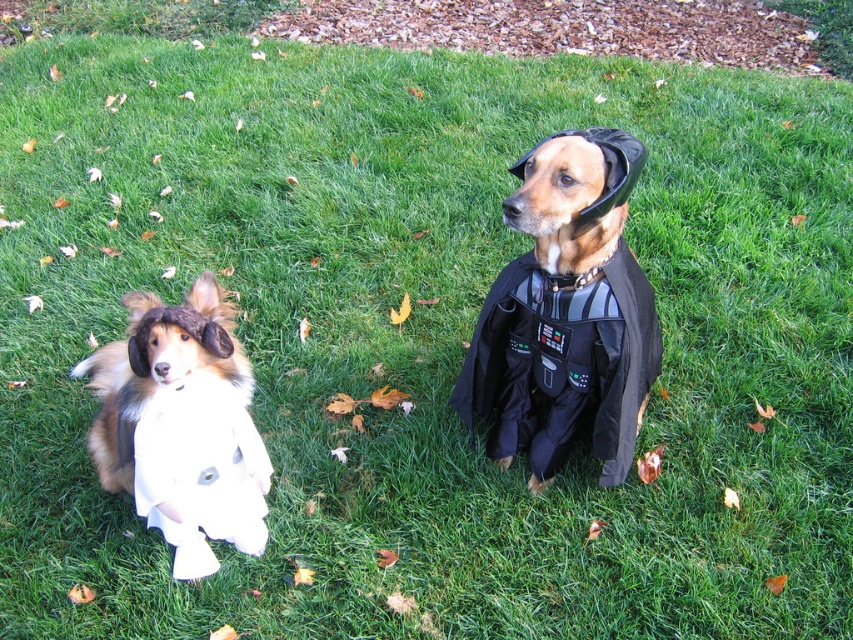
Which is in front, point (621, 131) or point (173, 540)?

Point (173, 540) is more forward.

Between point (560, 296) and point (138, 472), which one is positioned behind?

Positioned behind is point (560, 296).

I want to click on black matte costume at center, so click(566, 314).

Is white soft ghost at left further to camera compared to white fabric dress at left?

No, white soft ghost at left is in front of white fabric dress at left.

Is point (215, 390) less distant than point (160, 412)?

No, it is behind (160, 412).

Where is `white soft ghost at left`? white soft ghost at left is located at coordinates (181, 424).

Where is `white soft ghost at left`? The width and height of the screenshot is (853, 640). white soft ghost at left is located at coordinates (181, 424).

Is black matte costume at center taller than white fabric dress at left?

Yes, black matte costume at center is taller than white fabric dress at left.

Is point (473, 396) closer to camera compared to point (212, 515)?

No, (473, 396) is behind (212, 515).

I want to click on black matte costume at center, so click(566, 314).